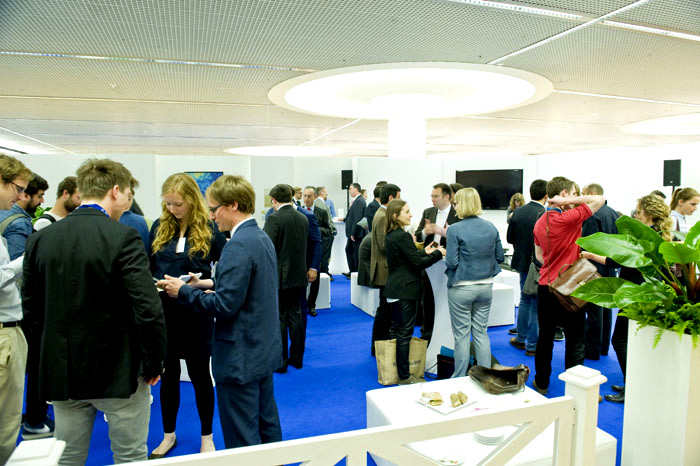
Identify the location of floor. (337, 369).